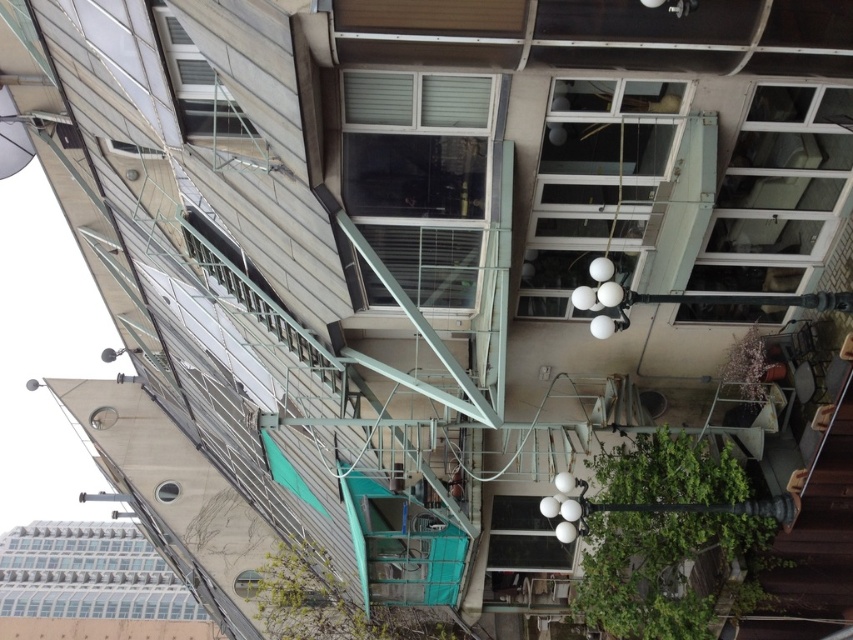
Question: Can you confirm if wooden at right is positioned below green matte plant at lower right?

Choices:
 (A) yes
 (B) no

Answer: (A)

Question: Can you confirm if green leafy plant at lower right is positioned above wooden at right?

Choices:
 (A) yes
 (B) no

Answer: (B)

Question: Among these objects, which one is farthest from the camera?

Choices:
 (A) green leafy plant at lower right
 (B) wooden at right

Answer: (A)

Question: Can you confirm if green leafy plant at lower right is positioned to the left of green matte plant at lower right?

Choices:
 (A) yes
 (B) no

Answer: (A)

Question: Which point is closer to the camera?

Choices:
 (A) green leafy plant at lower right
 (B) green leafy plant at lower center
 (C) wooden at right

Answer: (C)

Question: Among these objects, which one is nearest to the camera?

Choices:
 (A) wooden at right
 (B) green leafy plant at lower center
 (C) green matte plant at lower right
 (D) green leafy plant at lower right

Answer: (A)